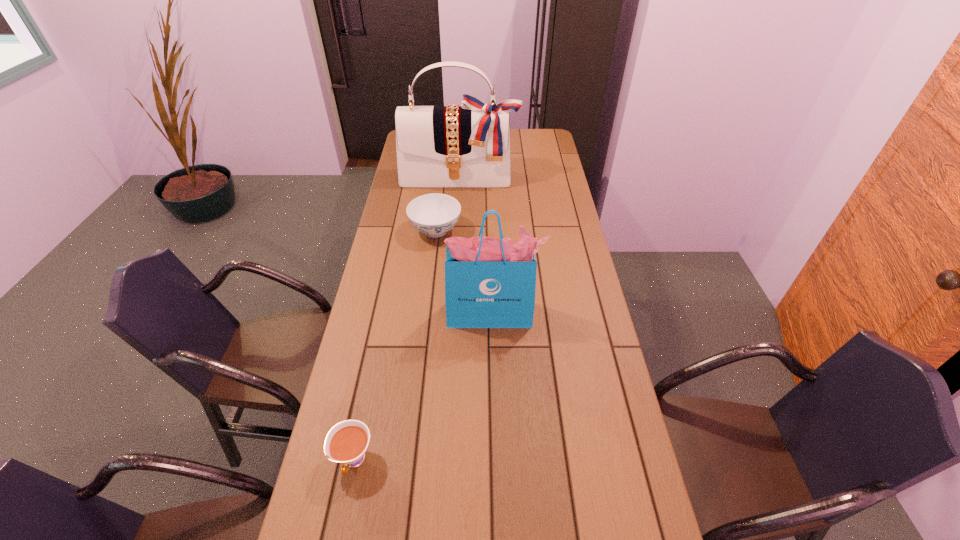
Find the location of `vacant area situated 0.160m on the front of the third tallest object`. vacant area situated 0.160m on the front of the third tallest object is located at coordinates (430, 277).

Locate an element on the screen. The image size is (960, 540). vacant space located on the side of the teacup with the handle is located at coordinates (344, 508).

At what (x,y) coordinates should I click in order to perform the action: click on satchel that is positioned at the left edge. Please return your answer as a coordinate pair (x, y). This screenshot has height=540, width=960. Looking at the image, I should click on click(x=469, y=145).

What are the coordinates of `chinaware located in the left edge section of the desktop` in the screenshot? It's located at (434, 214).

Locate an element on the screen. The height and width of the screenshot is (540, 960). teacup that is at the left edge is located at coordinates (346, 442).

At what (x,y) coordinates should I click in order to perform the action: click on vacant region at the left edge of the desktop. Please return your answer as a coordinate pair (x, y). The height and width of the screenshot is (540, 960). Looking at the image, I should click on (400, 237).

Identify the location of vacant space at the right edge. The height and width of the screenshot is (540, 960). (563, 287).

In the image, there is a desktop. What are the coordinates of `blank space at the far right corner` in the screenshot? It's located at (543, 133).

At what (x,y) coordinates should I click in order to perform the action: click on free space that is in between the shortest object and the chinaware. Please return your answer as a coordinate pair (x, y). The image size is (960, 540). Looking at the image, I should click on (395, 346).

Image resolution: width=960 pixels, height=540 pixels. I want to click on free spot between the satchel and the teacup, so pyautogui.click(x=406, y=319).